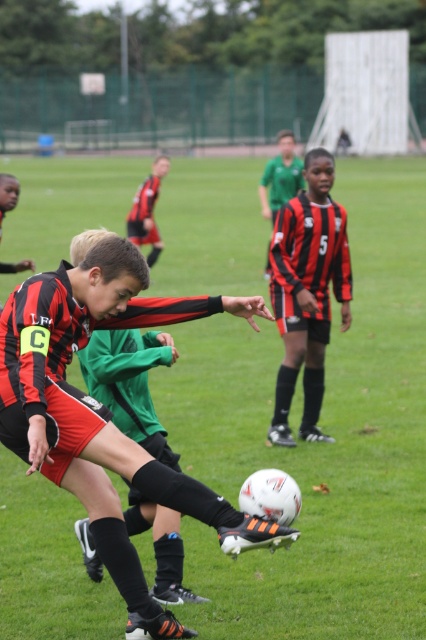
Consider the image. How distant is black matte jersey at center from black jersey at center?

6.34 meters

Which is behind, point (304, 228) or point (261, 176)?

Positioned behind is point (261, 176).

I want to click on black matte jersey at center, so click(x=307, y=291).

Is black jersey at center closer to the viewer compared to red/black jersey at center?

Yes.

Who is more forward, (x=284, y=173) or (x=138, y=186)?

Point (x=284, y=173) is more forward.

This screenshot has width=426, height=640. I want to click on black jersey at center, so click(281, 177).

Can you confirm if black matte jersey at center is positioned below red/black jersey at center?

Yes, black matte jersey at center is below red/black jersey at center.

Measure the distance between point (331, 205) and camera.

Point (331, 205) and camera are 8.25 meters apart from each other.

Is point (305, 280) less distant than point (155, 161)?

Yes, it is in front of point (155, 161).

You are a GUI agent. You are given a task and a screenshot of the screen. Output one action in this format:
    pyautogui.click(x=<x>, y=<y>)
    Task: Click on the black matte jersey at center
    This screenshot has width=426, height=640.
    Given the screenshot: What is the action you would take?
    pyautogui.click(x=307, y=291)